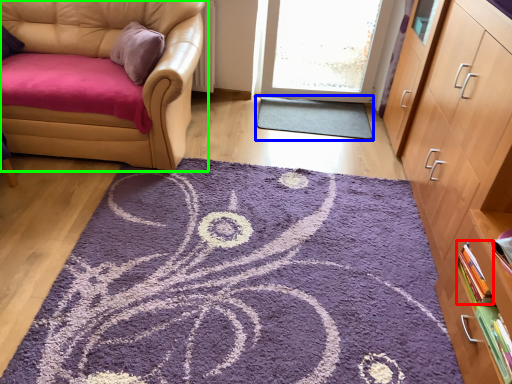
Question: Based on their relative distances, which object is nearer to book (highlighted by a red box)? Choose from doormat (highlighted by a blue box) and chair (highlighted by a green box).

Choices:
 (A) doormat
 (B) chair

Answer: (A)